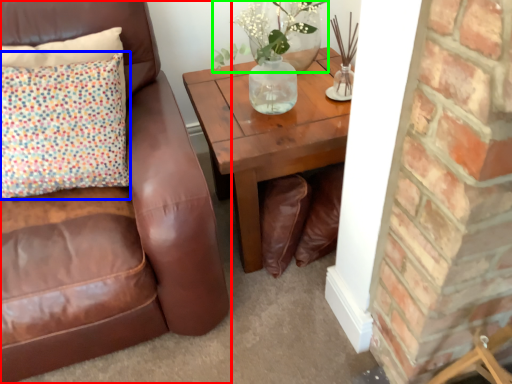
Question: Based on their relative distances, which object is farther from chair (highlighted by a red box)? Choose from pillow (highlighted by a blue box) and floral arrangement (highlighted by a green box).

Choices:
 (A) pillow
 (B) floral arrangement

Answer: (B)